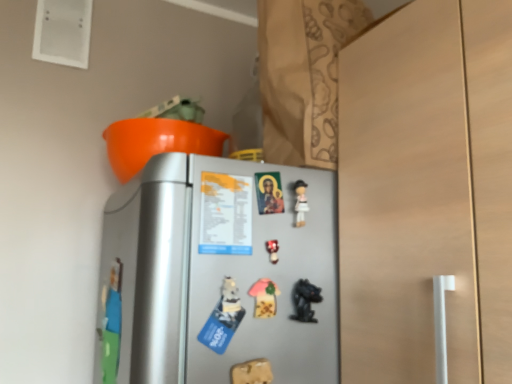
Question: Based on their positions, is wooden toy at lower center, which is the 1th toy in bottom-to-top order, located to the left or right of silver metallic refrigerator at center?

Choices:
 (A) right
 (B) left

Answer: (B)

Question: In terms of width, does wooden toy at lower center, which is the 4th toy from top to bottom, look wider or thinner when compared to silver metallic refrigerator at center?

Choices:
 (A) thin
 (B) wide

Answer: (B)

Question: Which object is positioned farthest from the pink fabric mushroom at center, the 2th toy in the top-to-bottom sequence?

Choices:
 (A) wooden toy at lower center, which is the 1th toy in bottom-to-top order
 (B) matte plastic toy at center, which is the first toy in top-to-bottom order
 (C) silver metallic refrigerator at center
 (D) black glossy figurine at lower center, positioned as the second toy in bottom-to-top order

Answer: (C)

Question: Which object is positioned closest to the wooden toy at lower center, which is the 4th toy from top to bottom?

Choices:
 (A) silver metallic refrigerator at center
 (B) pink fabric mushroom at center, the 2th toy in the top-to-bottom sequence
 (C) black glossy figurine at lower center, the 3th toy when ordered from top to bottom
 (D) matte plastic toy at center, which is the first toy in top-to-bottom order

Answer: (B)